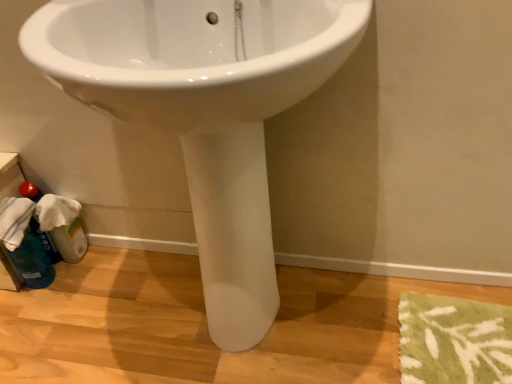
Identify the location of free space underneath white glossy sink at center (from a real-world perspective). Image resolution: width=512 pixels, height=384 pixels. (231, 340).